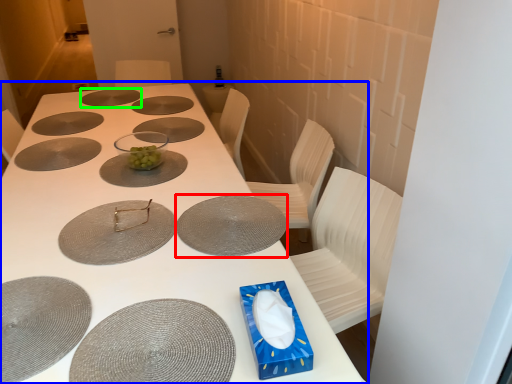
Question: Which object is the farthest from glass plate (highlighted by a red box)? Choose among these: table (highlighted by a blue box) or glass plate (highlighted by a green box).

Choices:
 (A) table
 (B) glass plate

Answer: (B)